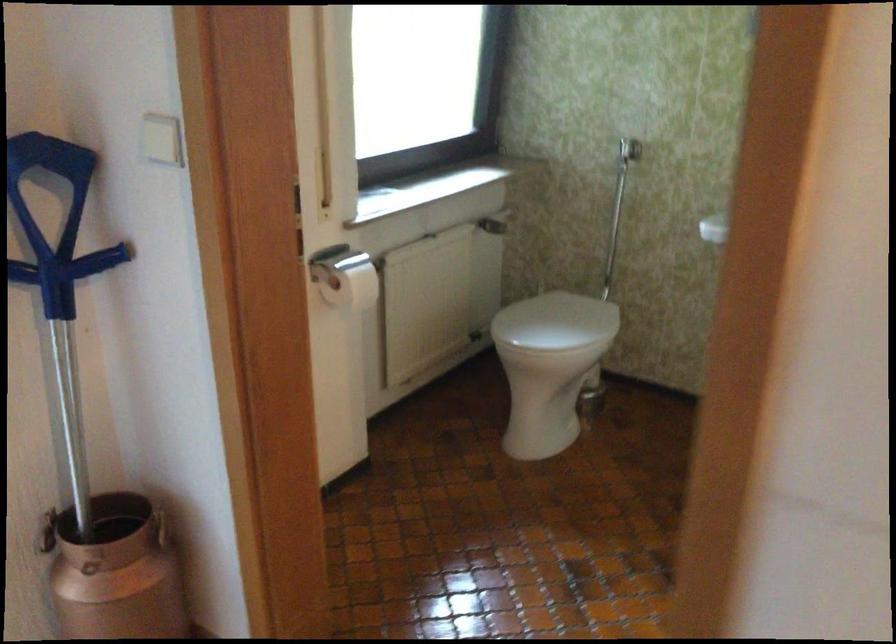
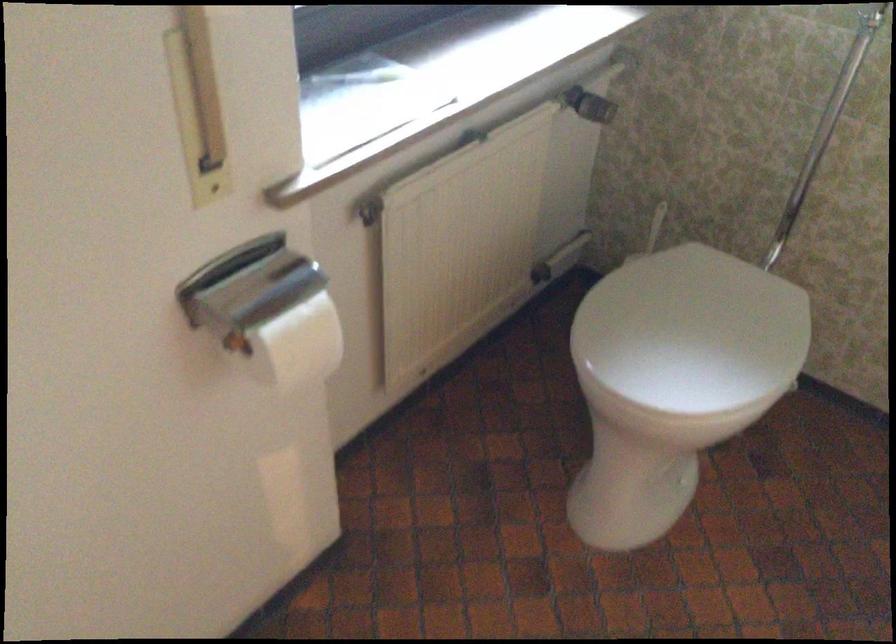
The point at (351, 285) is marked in the first image. Where is the corresponding point in the second image?

(298, 345)